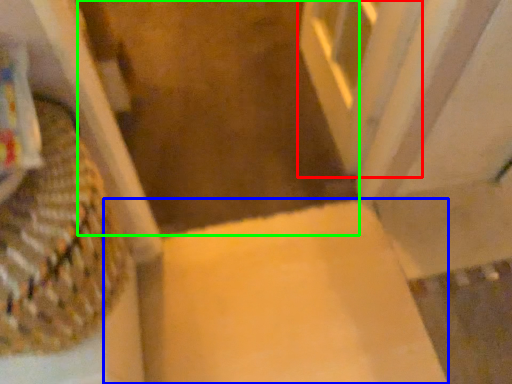
Question: Which object is the farthest from screen door (highlighted by a red box)? Choose among these: cardboard box (highlighted by a blue box) or aisle (highlighted by a green box).

Choices:
 (A) cardboard box
 (B) aisle

Answer: (A)